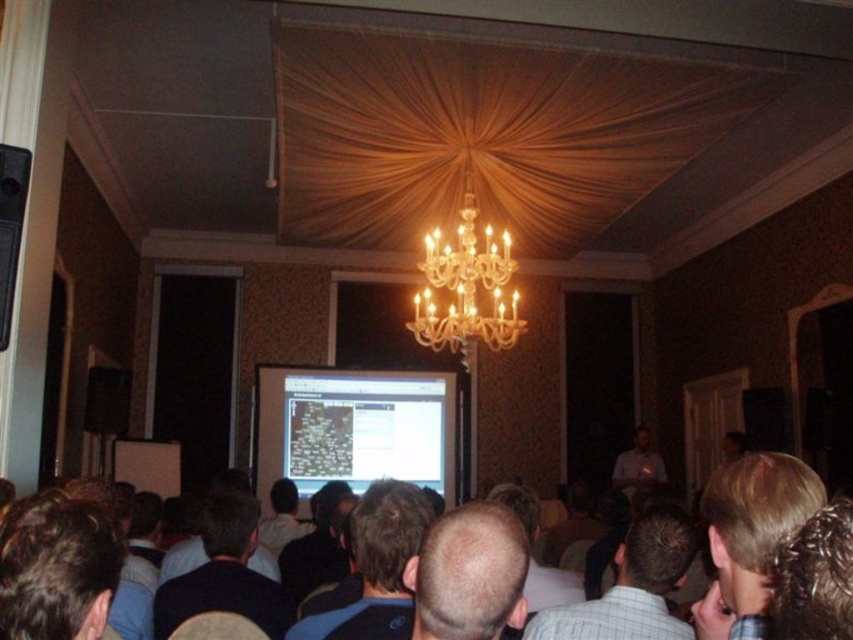
Is point (274, 385) behind point (659, 540)?

Yes, it is.

Measure the distance between white glossy projection screen at center and light blue shirt at center.

5.71 meters

What are the coordinates of `white glossy projection screen at center` in the screenshot? It's located at (351, 428).

Who is more forward, (x=643, y=612) or (x=485, y=336)?

Point (x=643, y=612) is in front.

Can you confirm if light blue shirt at center is positioned to the left of crystal glass chandelier at center?

No, light blue shirt at center is not to the left of crystal glass chandelier at center.

Is point (685, 516) closer to viewer compared to point (502, 296)?

Yes, it is in front of point (502, 296).

Find the location of `light blue shirt at center`. light blue shirt at center is located at coordinates (631, 586).

Does dark brown hair at lower left have a smaller size compared to dark blue shirt at center?

Yes, dark brown hair at lower left is smaller than dark blue shirt at center.

Who is more forward, (x=68, y=557) or (x=315, y=508)?

Point (x=68, y=557)

Which is behind, point (13, 554) or point (326, 554)?

The point (326, 554) is behind.

The width and height of the screenshot is (853, 640). Identify the location of dark brown hair at lower left. (57, 570).